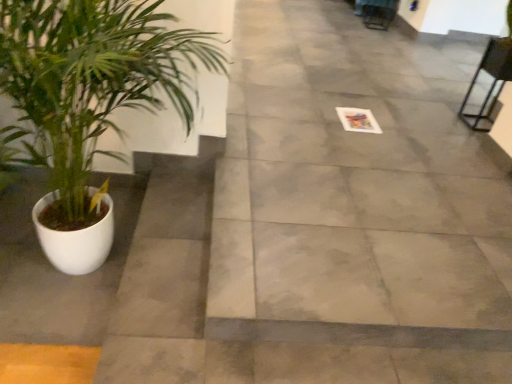
Question: Is gray concrete pavement at center further to the viewer compared to metallic black chair at upper right?

Choices:
 (A) yes
 (B) no

Answer: (B)

Question: Is gray concrete pavement at center bigger than metallic black chair at upper right?

Choices:
 (A) yes
 (B) no

Answer: (A)

Question: Can you confirm if gray concrete pavement at center is shorter than metallic black chair at upper right?

Choices:
 (A) yes
 (B) no

Answer: (A)

Question: Would you say gray concrete pavement at center contains metallic black chair at upper right?

Choices:
 (A) no
 (B) yes

Answer: (A)

Question: Considering the relative sizes of gray concrete pavement at center and metallic black chair at upper right in the image provided, is gray concrete pavement at center thinner than metallic black chair at upper right?

Choices:
 (A) no
 (B) yes

Answer: (A)

Question: In the image, is gray concrete pavement at center on the left side or the right side of metallic black chair at upper right?

Choices:
 (A) right
 (B) left

Answer: (B)

Question: Choose the correct answer: Is gray concrete pavement at center inside metallic black chair at upper right or outside it?

Choices:
 (A) inside
 (B) outside

Answer: (B)

Question: From a real-world perspective, is gray concrete pavement at center positioned above or below metallic black chair at upper right?

Choices:
 (A) above
 (B) below

Answer: (B)

Question: In the image, is gray concrete pavement at center positioned in front of or behind metallic black chair at upper right?

Choices:
 (A) front
 (B) behind

Answer: (A)

Question: Based on their positions, is metallic black chair at upper right located to the left or right of gray concrete pavement at center?

Choices:
 (A) right
 (B) left

Answer: (A)

Question: Is point (504, 69) closer or farther from the camera than point (435, 326)?

Choices:
 (A) closer
 (B) farther

Answer: (B)

Question: Considering their positions, is metallic black chair at upper right located in front of or behind gray concrete pavement at center?

Choices:
 (A) behind
 (B) front

Answer: (A)

Question: In terms of height, does metallic black chair at upper right look taller or shorter compared to gray concrete pavement at center?

Choices:
 (A) tall
 (B) short

Answer: (A)

Question: From the image's perspective, relative to metallic black chair at upper right, is green leafy plant at left above or below?

Choices:
 (A) above
 (B) below

Answer: (B)

Question: From their relative heights in the image, would you say green leafy plant at left is taller or shorter than metallic black chair at upper right?

Choices:
 (A) short
 (B) tall

Answer: (B)